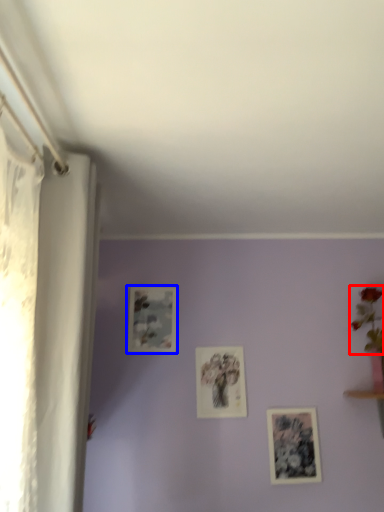
Question: Which of the following is the closest to the observer, floral arrangement (highlighted by a red box) or picture frame (highlighted by a blue box)?

Choices:
 (A) floral arrangement
 (B) picture frame

Answer: (A)